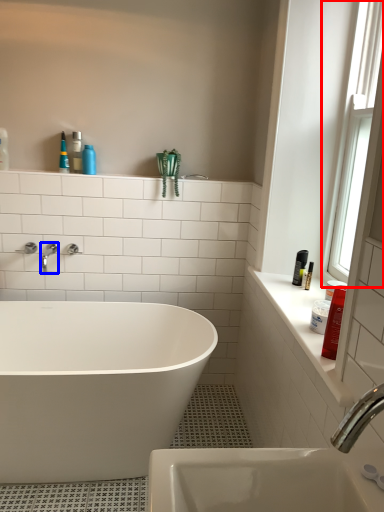
Question: Which point is further to the camera, window (highlighted by a red box) or tap (highlighted by a blue box)?

Choices:
 (A) window
 (B) tap

Answer: (B)